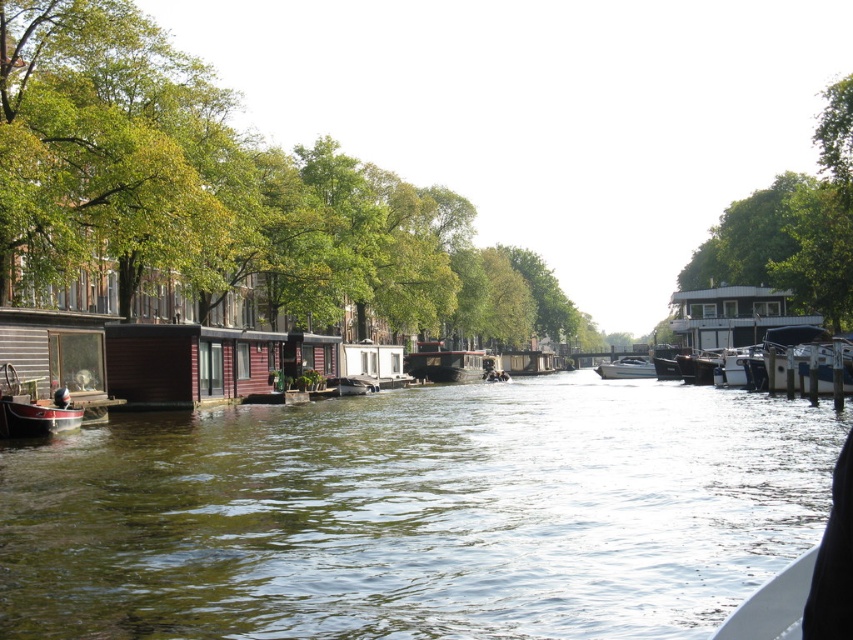
You are a photographer planning to take a wide shot of the white glossy houseboat at right and the green leafy tree at upper center. Which object would you need to adjust your camera angle to capture fully in the frame?

The green leafy tree at upper center might be wider than the white glossy houseboat at right, so you may need to adjust your camera angle to capture the entire width of the tree.

You are a tourist standing on the canal bridge and want to take a photo of both the red polished wood boat at lower left and the wooden cabin cruiser at center. Which boat should you position closer to the bridge to ensure both are in the frame?

The red polished wood boat at lower left is shorter than the wooden cabin cruiser at center, so you should position the red polished wood boat at lower left closer to the bridge to ensure both are visible in the photo.